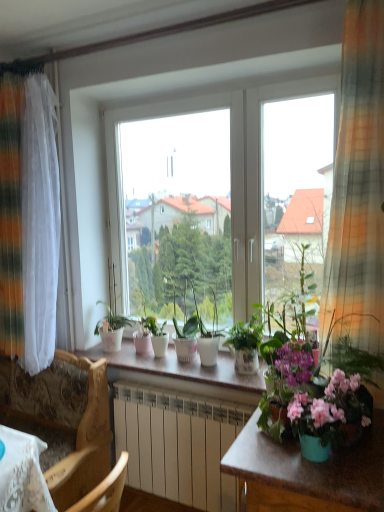
Question: Is matte white pot at center, the 5th houseplant when ordered from right to left, looking in the opposite direction of matte white pot at center, positioned as the 4th houseplant in right-to-left order?

Choices:
 (A) yes
 (B) no

Answer: (B)

Question: Can you confirm if matte white pot at center, the 2th houseplant from the left, is positioned to the right of matte white pot at center, which appears as the 3th houseplant when viewed from the left?

Choices:
 (A) yes
 (B) no

Answer: (B)

Question: Considering the relative positions of matte white pot at center, the 2th houseplant from the left, and matte white pot at center, which appears as the 3th houseplant when viewed from the left, in the image provided, is matte white pot at center, the 2th houseplant from the left, to the left of matte white pot at center, which appears as the 3th houseplant when viewed from the left, from the viewer's perspective?

Choices:
 (A) no
 (B) yes

Answer: (B)

Question: Is matte white pot at center, the 2th houseplant from the left, placed right next to matte white pot at center, which appears as the 3th houseplant when viewed from the left?

Choices:
 (A) no
 (B) yes

Answer: (A)

Question: Considering the relative positions of matte white pot at center, the 5th houseplant when ordered from right to left, and matte white pot at center, positioned as the 4th houseplant in right-to-left order, in the image provided, is matte white pot at center, the 5th houseplant when ordered from right to left, behind matte white pot at center, positioned as the 4th houseplant in right-to-left order,?

Choices:
 (A) no
 (B) yes

Answer: (B)

Question: Considering the relative sizes of matte white pot at center, the 2th houseplant from the left, and matte white pot at center, which appears as the 3th houseplant when viewed from the left, in the image provided, is matte white pot at center, the 2th houseplant from the left, smaller than matte white pot at center, which appears as the 3th houseplant when viewed from the left,?

Choices:
 (A) yes
 (B) no

Answer: (A)

Question: From a real-world perspective, is green glossy plant at center, which ranks as the sixth houseplant in left-to-right order, below white glossy pot at center, arranged as the third houseplant when viewed from the right?

Choices:
 (A) yes
 (B) no

Answer: (B)

Question: Does green glossy plant at center, which ranks as the sixth houseplant in left-to-right order, have a larger size compared to white glossy pot at center, arranged as the third houseplant when viewed from the right?

Choices:
 (A) no
 (B) yes

Answer: (B)

Question: Is green glossy plant at center, placed as the 1th houseplant when sorted from right to left, facing towards white glossy pot at center, the 4th houseplant when ordered from left to right?

Choices:
 (A) yes
 (B) no

Answer: (B)

Question: From the image's perspective, is green glossy plant at center, placed as the 1th houseplant when sorted from right to left, on top of white glossy pot at center, the 4th houseplant when ordered from left to right?

Choices:
 (A) yes
 (B) no

Answer: (A)

Question: Considering the relative positions of green glossy plant at center, which ranks as the sixth houseplant in left-to-right order, and white glossy pot at center, arranged as the third houseplant when viewed from the right, in the image provided, is green glossy plant at center, which ranks as the sixth houseplant in left-to-right order, behind white glossy pot at center, arranged as the third houseplant when viewed from the right,?

Choices:
 (A) no
 (B) yes

Answer: (A)

Question: Considering the relative sizes of green glossy plant at center, which ranks as the sixth houseplant in left-to-right order, and white glossy pot at center, arranged as the third houseplant when viewed from the right, in the image provided, is green glossy plant at center, which ranks as the sixth houseplant in left-to-right order, smaller than white glossy pot at center, arranged as the third houseplant when viewed from the right,?

Choices:
 (A) yes
 (B) no

Answer: (B)

Question: Does white glossy counter top at center have a greater height compared to white glossy pot at center, the first houseplant when ordered from left to right?

Choices:
 (A) no
 (B) yes

Answer: (A)